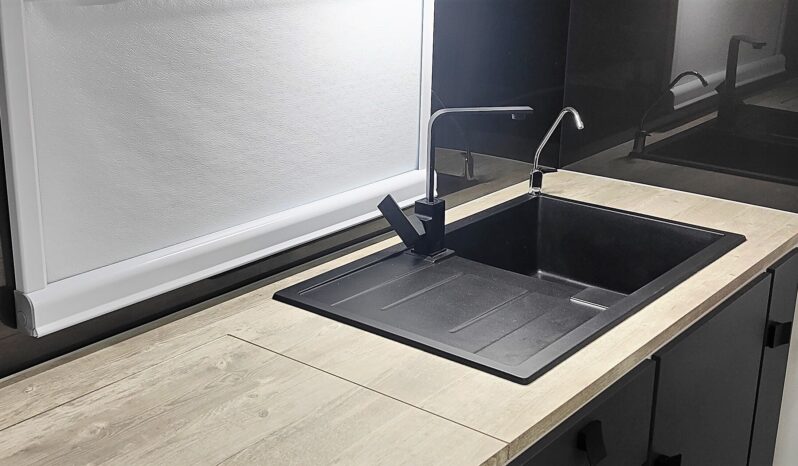
Please find where you'd turn the faucet head in the image and show me where they are. Your answer should be formatted as a list of tuples, i.e. [(x1, y1), (x2, y2), ...], where each tuple contains the x and y coordinates of a point satisfying the conditions above.

[(500, 108)]